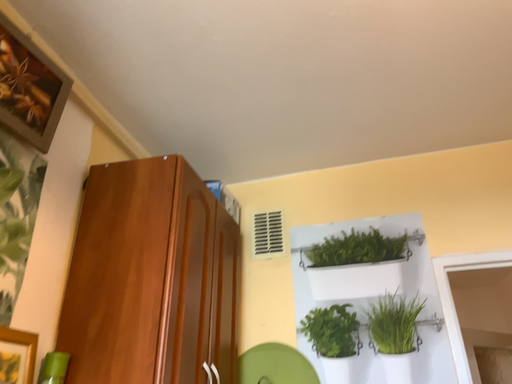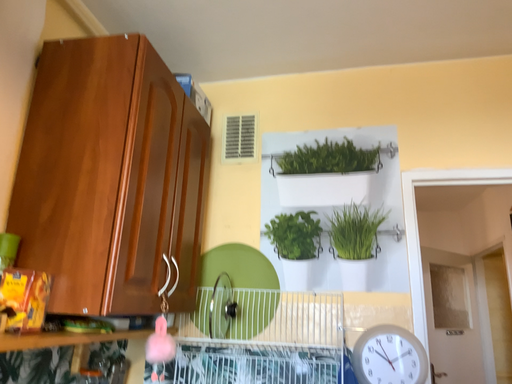
Question: Which way did the camera rotate in the video?

Choices:
 (A) rotated downward
 (B) rotated upward

Answer: (A)